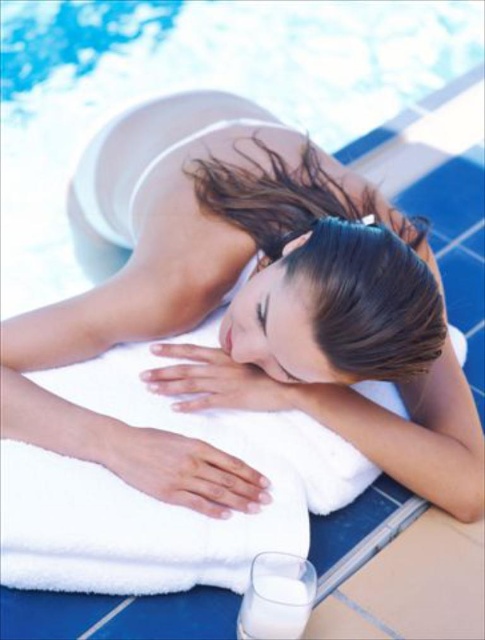
The height and width of the screenshot is (640, 485). Identify the location of white soft towel at upper center. (258, 326).

Is white soft towel at upper center thinner than white opaque glass at lower center?

No.

Does point (454, 461) come farther from viewer compared to point (269, 608)?

Yes, it is.

The width and height of the screenshot is (485, 640). In order to click on white soft towel at upper center in this screenshot , I will do `click(258, 326)`.